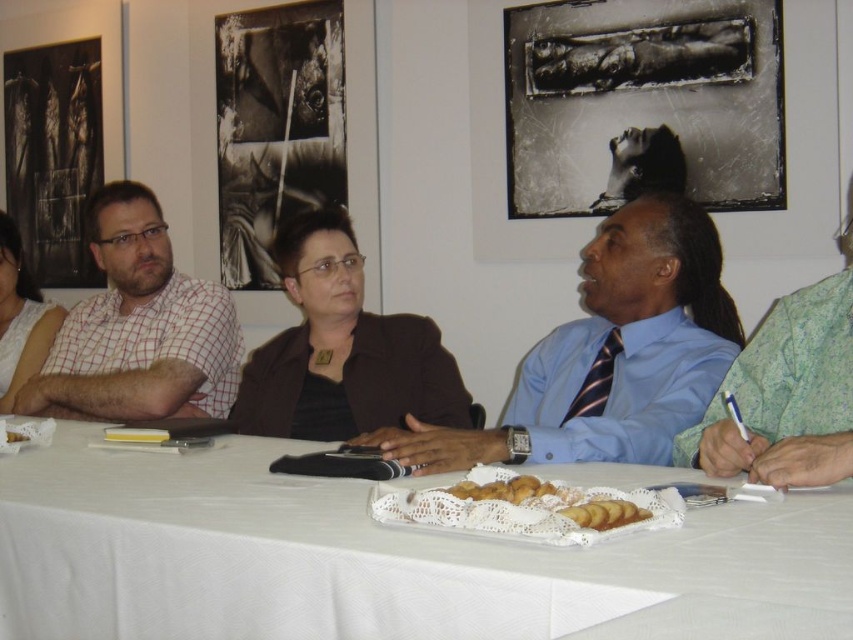
Question: Which point is farther to the camera?

Choices:
 (A) (577, 513)
 (B) (358, 609)

Answer: (A)

Question: Where is green floral shirt at right located in relation to golden brown pastry at center in the image?

Choices:
 (A) below
 (B) above

Answer: (B)

Question: Where is blue shirt and tie at center located in relation to checkered fabric shirt at left in the image?

Choices:
 (A) right
 (B) left

Answer: (A)

Question: Which point is closer to the camera?

Choices:
 (A) golden brown pastry at center
 (B) white cloth table at center
 (C) green floral shirt at right
 (D) checkered fabric shirt at left

Answer: (B)

Question: Does checkered fabric shirt at left appear on the right side of green floral shirt at right?

Choices:
 (A) yes
 (B) no

Answer: (B)

Question: Which object is the closest to the checkered fabric shirt at left?

Choices:
 (A) white cloth table at center
 (B) blue shirt and tie at center
 (C) green floral shirt at right
 (D) golden brown pastry at center

Answer: (A)